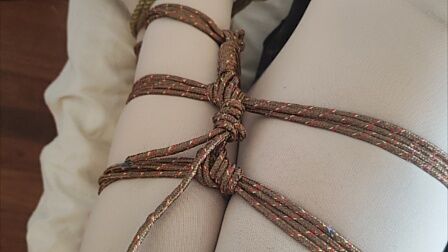
Find the location of a particular element. This screenshot has width=448, height=252. brown wood flooring is located at coordinates (10, 81).